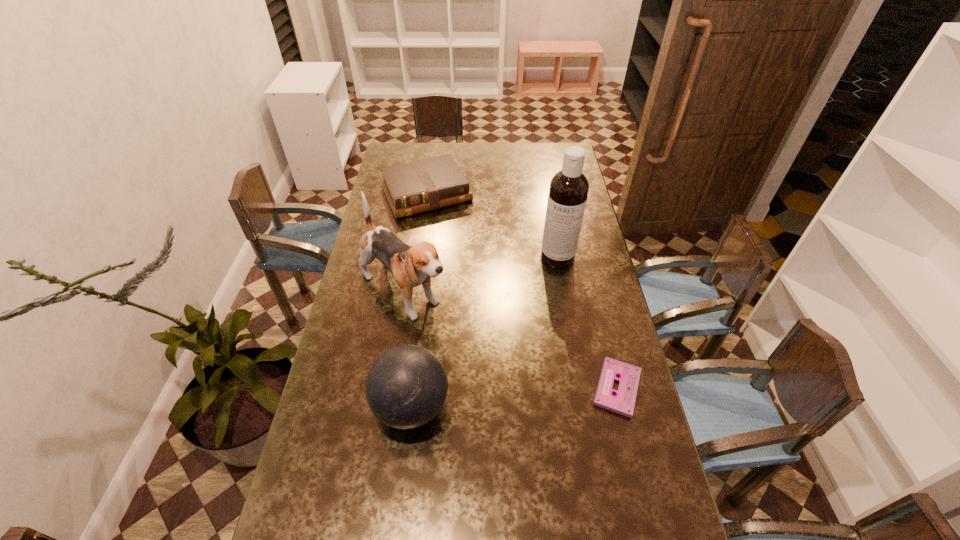
Image resolution: width=960 pixels, height=540 pixels. In order to click on free space located 0.240m at the face of the fourth shortest object in this screenshot , I will do `click(484, 362)`.

This screenshot has width=960, height=540. What are the coordinates of `vacant region located 0.320m on the label side of the tallest object` in the screenshot? It's located at (540, 335).

Identify the location of free location located 0.250m on the label side of the tallest object. (543, 319).

I want to click on vacant space situated 0.280m on the label side of the tallest object, so point(541,326).

The image size is (960, 540). I want to click on vacant space positioned on the spine side of the farthest object, so click(462, 254).

This screenshot has width=960, height=540. Find the location of `vacant space located 0.350m on the spine side of the farthest object`. vacant space located 0.350m on the spine side of the farthest object is located at coordinates click(x=472, y=273).

The height and width of the screenshot is (540, 960). What are the coordinates of `vacant space located 0.210m on the spine side of the farthest object` in the screenshot? It's located at (459, 249).

Where is `bowling ball at the left edge`? bowling ball at the left edge is located at coordinates (406, 387).

Identify the location of puppy positioned at the left edge. (410, 266).

At what (x,y) coordinates should I click in order to perform the action: click on Bible located in the left edge section of the desktop. Please return your answer as a coordinate pair (x, y). The height and width of the screenshot is (540, 960). Looking at the image, I should click on (418, 186).